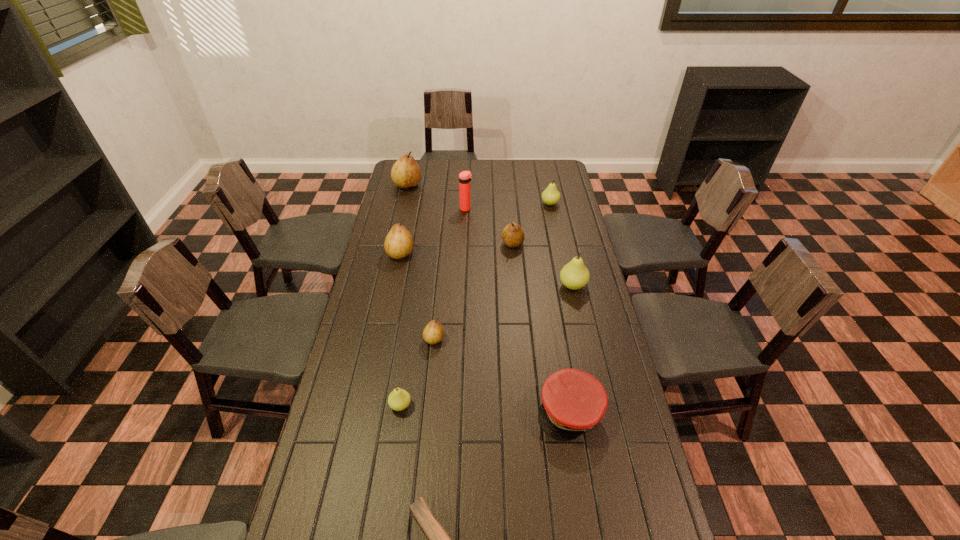
You are a GUI agent. You are given a task and a screenshot of the screen. Output one action in this format:
    pyautogui.click(x=<x>, y=<y>)
    Task: Click on the farthest object
    The image size is (960, 540).
    Given the screenshot: What is the action you would take?
    pyautogui.click(x=405, y=173)

Locate an element on the screen. The image size is (960, 540). the tallest pear is located at coordinates (405, 173).

Image resolution: width=960 pixels, height=540 pixels. What are the coordinates of `thermos bottle` in the screenshot? It's located at (465, 177).

You are a GUI agent. You are given a task and a screenshot of the screen. Output one action in this format:
    pyautogui.click(x=<x>, y=<y>)
    Task: Click on the third smallest brown pear
    This screenshot has width=960, height=540.
    Given the screenshot: What is the action you would take?
    pyautogui.click(x=398, y=244)

This screenshot has width=960, height=540. Find the location of `the second farthest green pear`. the second farthest green pear is located at coordinates (574, 275).

You are a GUI agent. You are given a task and a screenshot of the screen. Output one action in this format:
    pyautogui.click(x=<x>, y=<y>)
    Task: Click on the fifth nearest object
    The width and height of the screenshot is (960, 540).
    Given the screenshot: What is the action you would take?
    pyautogui.click(x=574, y=275)

Where is `the rightmost brown pear`? This screenshot has width=960, height=540. the rightmost brown pear is located at coordinates (513, 236).

This screenshot has height=540, width=960. I want to click on the fifth pear from left to right, so click(513, 236).

Identify the location of the second farthest pear. Image resolution: width=960 pixels, height=540 pixels. (550, 196).

Locate an element on the screen. the second smallest green pear is located at coordinates (550, 196).